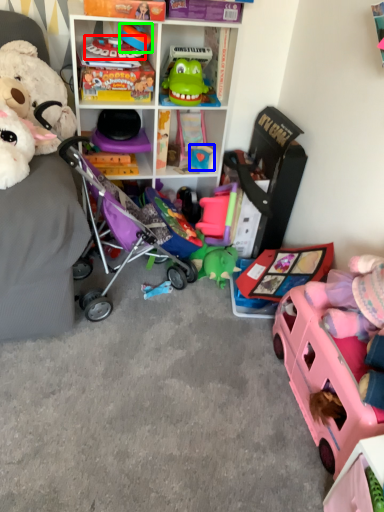
Question: Which object is the closest to the toy (highlighted by a red box)? Choose among these: toy (highlighted by a blue box) or toy (highlighted by a green box).

Choices:
 (A) toy
 (B) toy

Answer: (B)